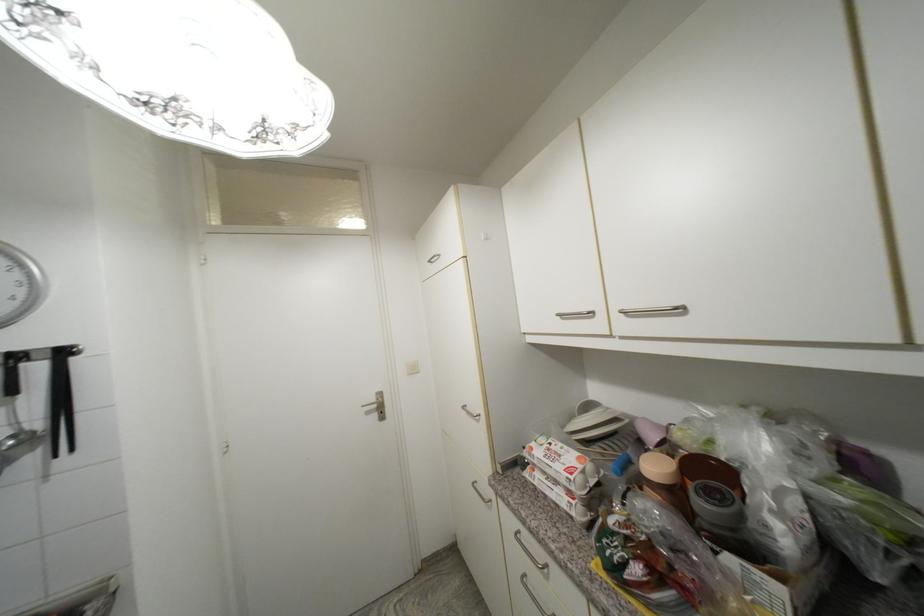
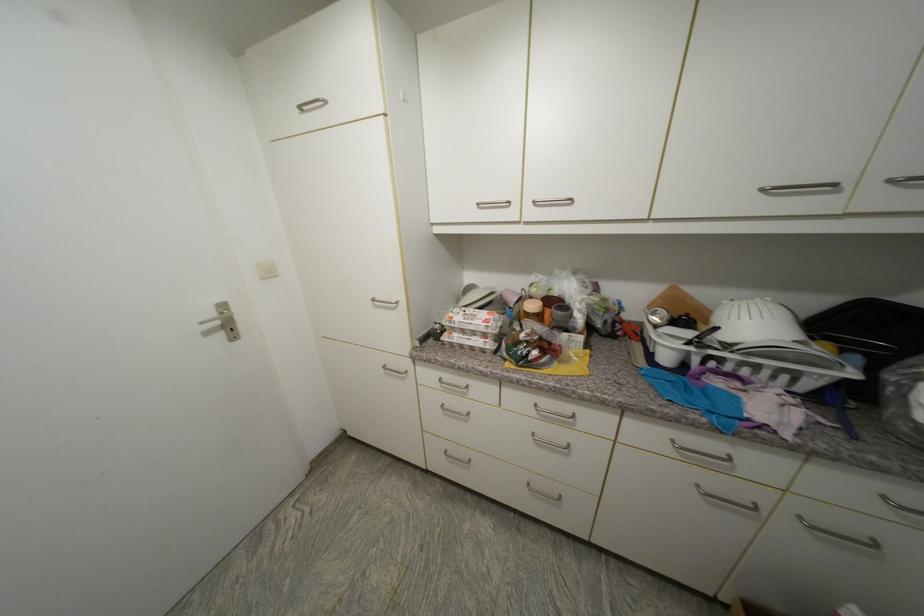
Where in the second image is the point corresponding to pixel 662 469 from the first image?

(538, 307)